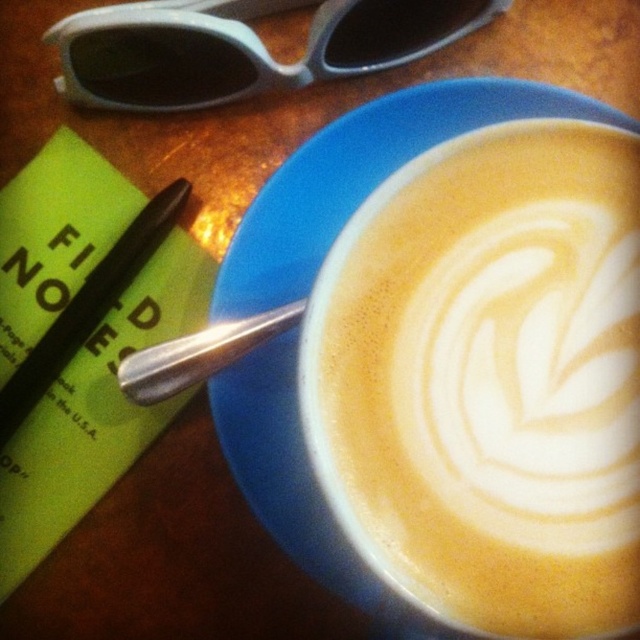
You are a barista arranging items on a counter. You need to place the matte plastic sunglasses at upper left and the silver metallic spoon at lower left so they don not overlap. Given their positions, which item should you move to the right to prevent overlapping?

The matte plastic sunglasses at upper left should be moved to the right since they might be wider than the silver metallic spoon at lower left, potentially causing overlap if not adjusted.

From the picture: You are a barista arranging items on a counter. You have the foamy white coffee at center and the silver metallic spoon at lower left. To make space for a new order, you need to move one item to the right. Which item should you move to ensure the spoon is no longer on the left side of the coffee?

You should move the silver metallic spoon at lower left to the right. Since the foamy white coffee at center is already on the right side of the spoon, moving the spoon to the right would place it to the left of the coffee, but since the question requires the spoon to no longer be on the left side, you need to move the spoon further right so it is positioned to the right of the coffee. However, based on the original description, the coffee is to the right of the spoon. To ensure the spoon is no longer onthe

You are a barista arranging items on a counter. You need to place a silver metallic spoon at lower left so it doesn t fall into the foamy white coffee at center. Based on their positions, is the spoon currently in a safe position?

The foamy white coffee at center is located below the silver metallic spoon at lower left, so the spoon is currently in a safe position and won t fall into the coffee.